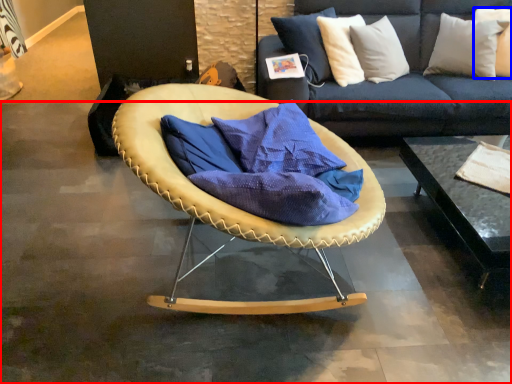
Question: Which point is further to the camera, concrete (highlighted by a red box) or pillow (highlighted by a blue box)?

Choices:
 (A) concrete
 (B) pillow

Answer: (B)